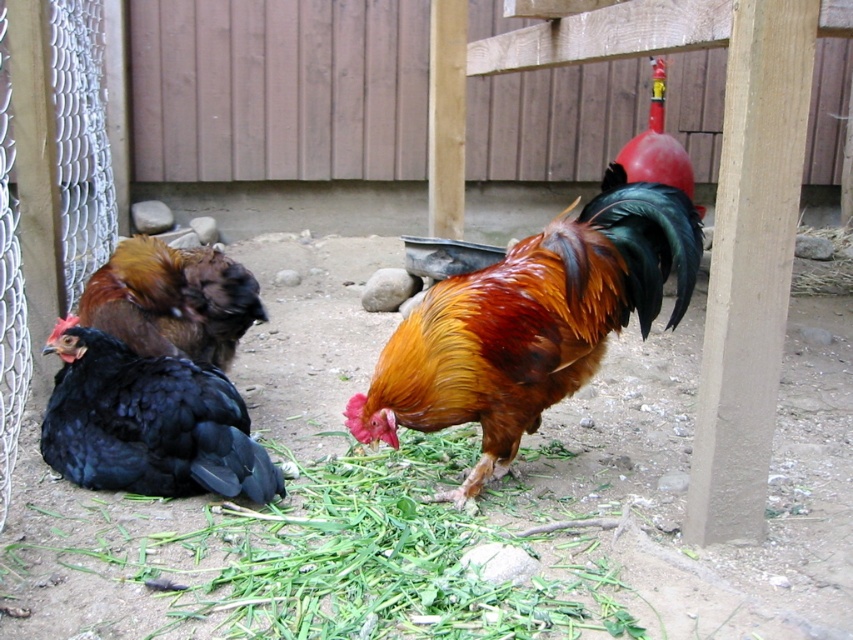
Question: Which is farther from the black glossy chicken at left?

Choices:
 (A) green leafy grass at center
 (B) shiny brown rooster at center
 (C) black matte chicken at lower left

Answer: (B)

Question: Can you confirm if green leafy grass at center is positioned to the left of shiny brown rooster at center?

Choices:
 (A) yes
 (B) no

Answer: (A)

Question: Where is shiny brown rooster at center located in relation to black matte chicken at lower left in the image?

Choices:
 (A) left
 (B) right

Answer: (B)

Question: Among these points, which one is farthest from the camera?

Choices:
 (A) (80, 547)
 (B) (80, 317)
 (C) (85, 381)

Answer: (B)

Question: Does green leafy grass at center appear on the left side of black matte chicken at lower left?

Choices:
 (A) no
 (B) yes

Answer: (A)

Question: Which point is closer to the camera?

Choices:
 (A) black matte chicken at lower left
 (B) green leafy grass at center

Answer: (B)